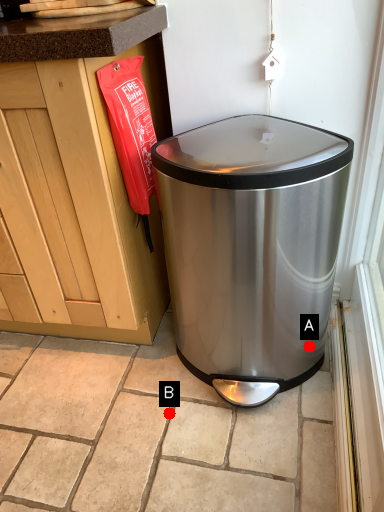
Question: Two points are circled on the image, labeled by A and B beside each circle. Which of the following is the farthest from the observer?

Choices:
 (A) A is further
 (B) B is further

Answer: (A)